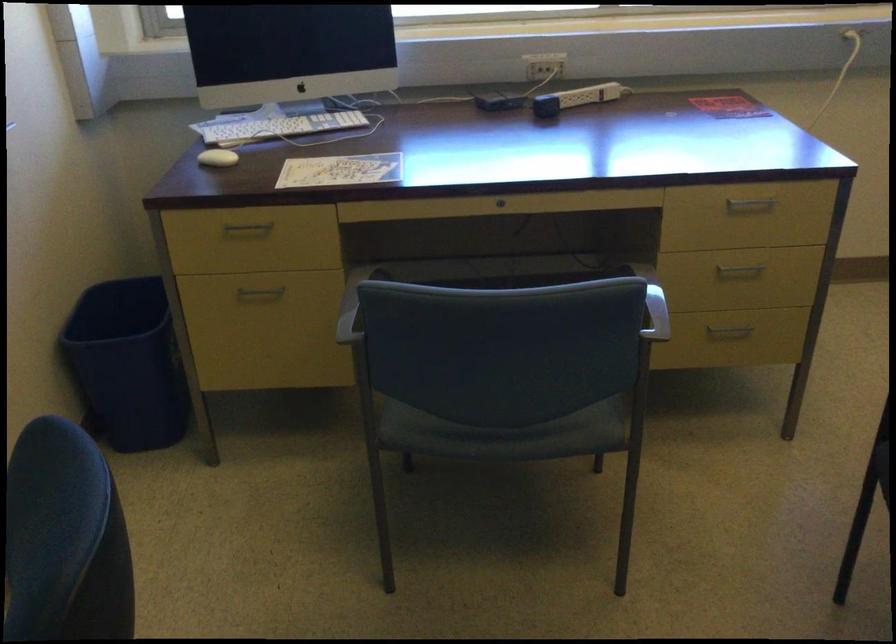
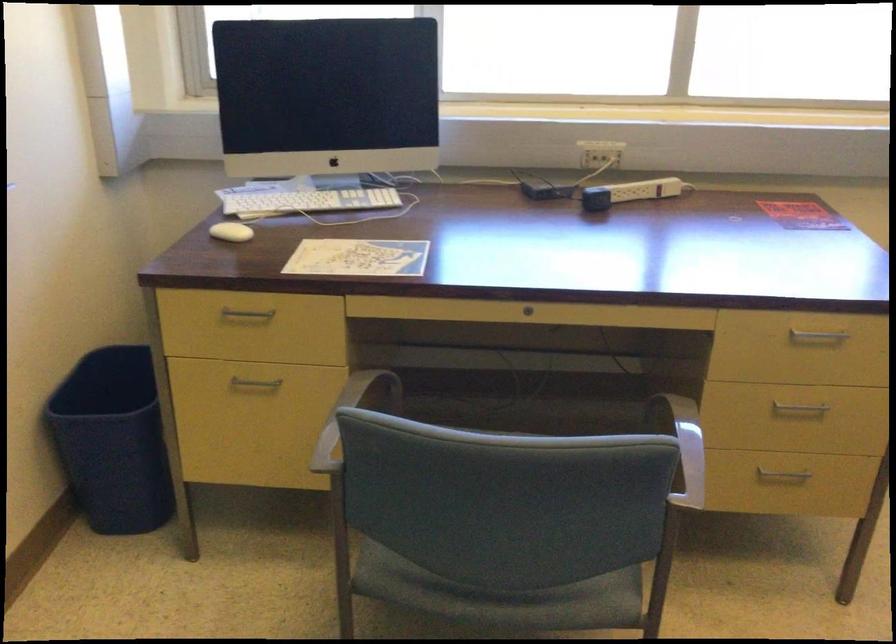
Locate, in the second image, the point that corresponds to [368,288] in the first image.

(350, 415)